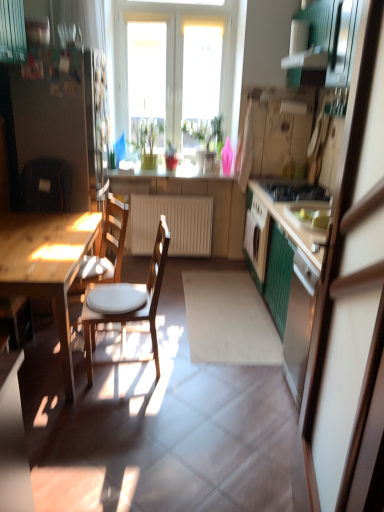
This screenshot has height=512, width=384. Identify the location of empty space that is ontop of wooden table at left (from a real-world perspective). (31, 238).